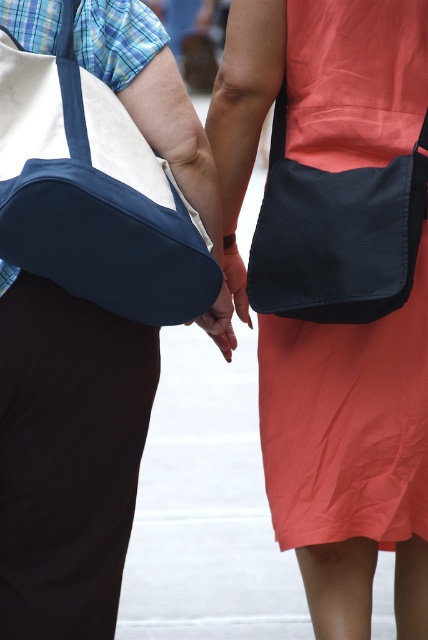
Question: Which point appears farthest from the camera in this image?

Choices:
 (A) (214, 328)
 (B) (73, 129)

Answer: (A)

Question: Does matte black apron at center appear on the right side of blue canvas messenger bag at left?

Choices:
 (A) no
 (B) yes

Answer: (B)

Question: Is blue canvas messenger bag at left below matte black hand at center?

Choices:
 (A) no
 (B) yes

Answer: (A)

Question: Which of the following is the farthest from the observer?

Choices:
 (A) (267, 480)
 (B) (65, 179)

Answer: (A)

Question: Which is farther from the matte black hand at center?

Choices:
 (A) matte black apron at center
 (B) blue canvas messenger bag at left

Answer: (B)

Question: Can you confirm if matte black apron at center is positioned above matte black hand at center?

Choices:
 (A) yes
 (B) no

Answer: (B)